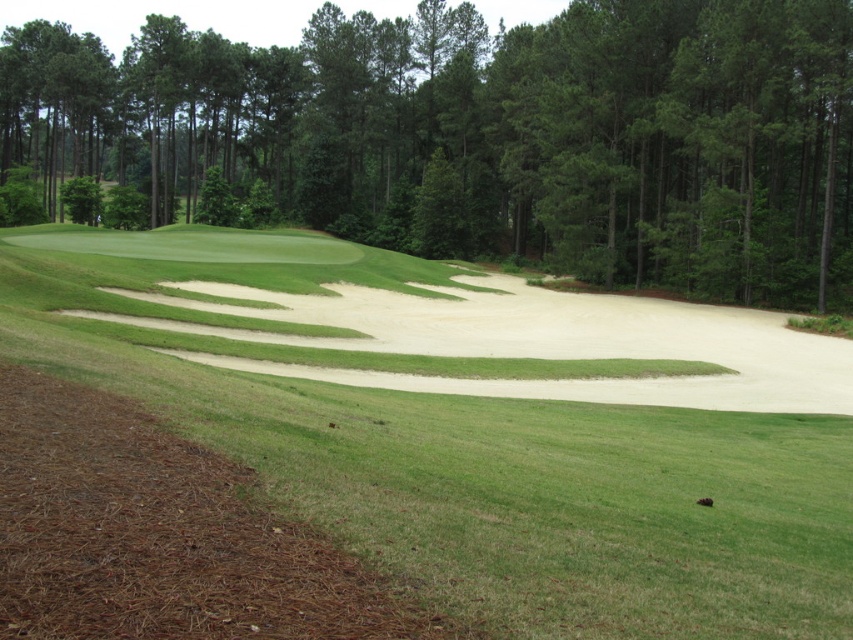
You are a golfer standing on the grassy area near the sandy beige sand trap at center and the green leafy tree at center. Which object is positioned to the left of the other?

The green leafy tree at center is to the left of the sandy beige sand trap at center.

You are a golfer standing on the grassy area in the foreground. You see the sandy beige sand trap at center and the green leafy tree at center. Which object is nearer to you?

The sandy beige sand trap at center is closer to the viewer than the green leafy tree at center, so the sand trap is nearer.

You are a golfer standing at the tee, trying to hit your ball into the hole located on the green. Based on the image, where is the sandy beige sand trap at center positioned relative to your current location?

The sandy beige sand trap at center is positioned at coordinates approximately 0.711 on the x axis and 0.550 on the y axis relative to your current position at the tee.